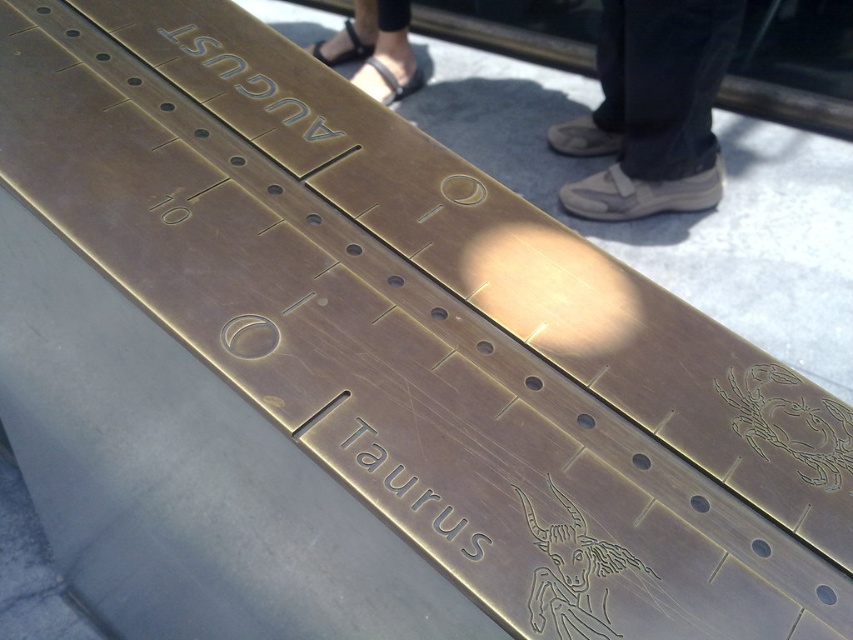
You are standing in a plaza and see the dark brown leather shoe at upper center and the black leather sandals at upper center. Which one is positioned more to the right side?

The dark brown leather shoe at upper center is positioned more to the right side than the black leather sandals at upper center.

You are standing in front of the plaque and notice two points marked on it. The first point is at coordinates point (x=355, y=22) and the second is at point (x=416, y=81). From your perspective, which point appears closer to you?

Point (x=416, y=81) appears closer to you because point (x=355, y=22) is behind it according to the spatial arrangement.